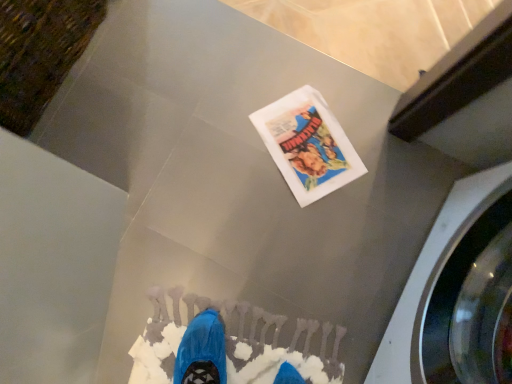
Where is `vacant area in front of white paper flyer at center`? This screenshot has height=384, width=512. vacant area in front of white paper flyer at center is located at coordinates (295, 225).